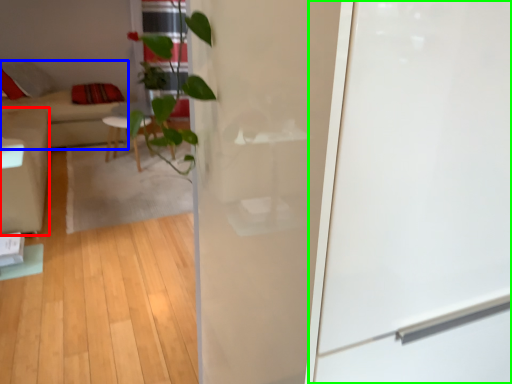
Question: Based on their relative distances, which object is nearer to armchair (highlighted by a red box)? Choose from couch (highlighted by a blue box) and screen door (highlighted by a green box).

Choices:
 (A) couch
 (B) screen door

Answer: (A)